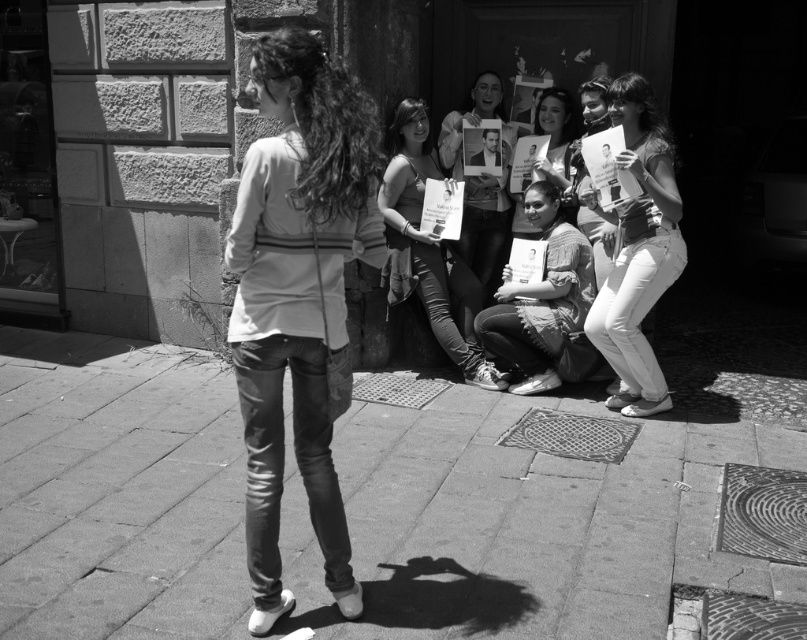
Can you confirm if matte paper poster at center is bigger than smooth paper poster at center?

Indeed, matte paper poster at center has a larger size compared to smooth paper poster at center.

Describe the element at coordinates (429, 250) in the screenshot. I see `matte paper poster at center` at that location.

Find the location of a particular element. matte paper poster at center is located at coordinates (429, 250).

Is white denim jeans at right positioned behind matte fabric shirt at center?

No, white denim jeans at right is in front of matte fabric shirt at center.

At what (x,y) coordinates should I click in order to perform the action: click on white denim jeans at right. Please return your answer as a coordinate pair (x, y). The image size is (807, 640). Looking at the image, I should click on (638, 252).

Where is `white denim jeans at right`? The image size is (807, 640). white denim jeans at right is located at coordinates (638, 252).

You are a GUI agent. You are given a task and a screenshot of the screen. Output one action in this format:
    pyautogui.click(x=<x>, y=<y>)
    Task: Click on the white denim jeans at right
    
    Given the screenshot: What is the action you would take?
    tap(638, 252)

Does smooth fabric poster at center appear on the right side of smooth paper poster at center?

No, smooth fabric poster at center is not to the right of smooth paper poster at center.

Which of these two, smooth fabric poster at center or smooth paper poster at center, stands taller?

Standing taller between the two is smooth fabric poster at center.

Between point (479, 74) and point (540, 177), which one is positioned behind?

The point (479, 74) is more distant.

You are a GUI agent. You are given a task and a screenshot of the screen. Output one action in this format:
    pyautogui.click(x=<x>, y=<y>)
    Task: Click on the smooth fabric poster at center
    
    Given the screenshot: What is the action you would take?
    pyautogui.click(x=479, y=179)